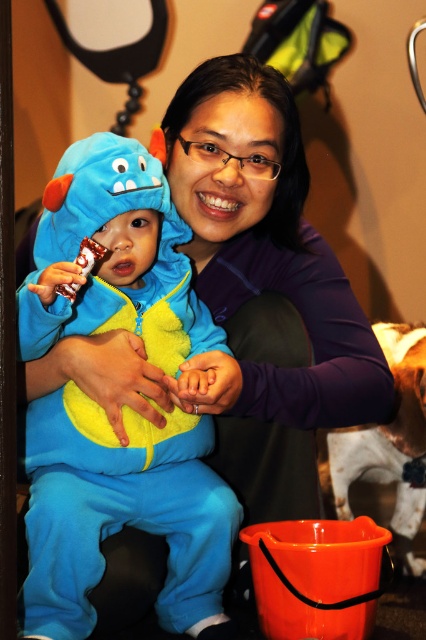
You are a photographer trying to capture a candid shot of the child and the adult. You notice the fuzzy blue onesie at left and the white fur dog at lower right in the frame. Which object should you focus on first if you want to capture the main subject of the scene?

The main subject of the scene is the adult and child interaction, so you should focus on the fuzzy blue onesie at left first since it is closer to the center of the action compared to the white fur dog at lower right.

You are a delivery robot with a package that needs to be placed between the fuzzy blue onesie at left and the white fur dog at lower right. The robot requires a minimum of 30 inches of space to safely navigate. Can you fit the package there?

The distance between the fuzzy blue onesie at left and the white fur dog at lower right is 28.60 inches, which is less than the required 30 inches. Therefore, the robot cannot safely navigate and place the package there.

You are a photographer taking a picture of the scene. You notice the fuzzy blue onesie at left and the white fur dog at lower right. Which object is closer to the camera?

The fuzzy blue onesie at left is closer to the camera because it is positioned over the white fur dog at lower right, indicating it is in front spatially.